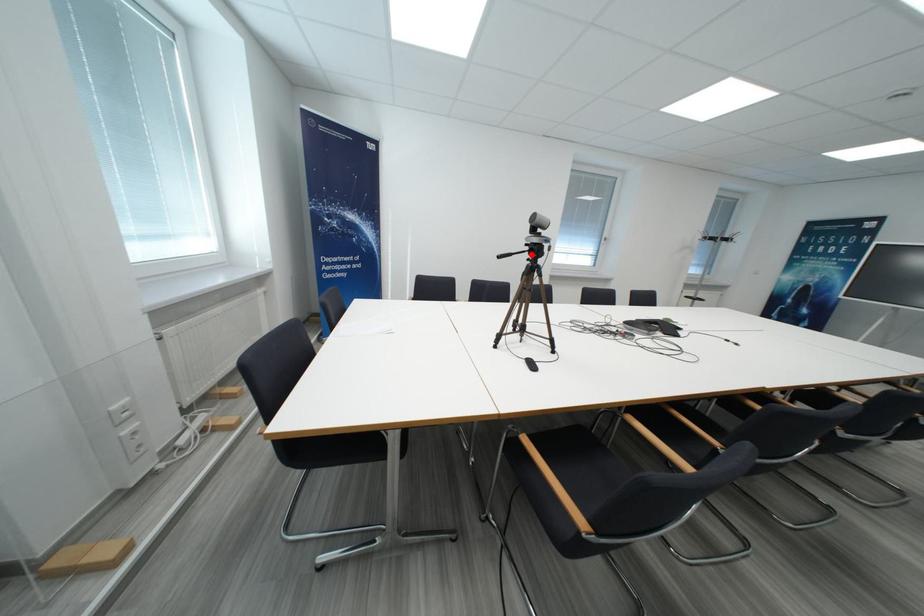
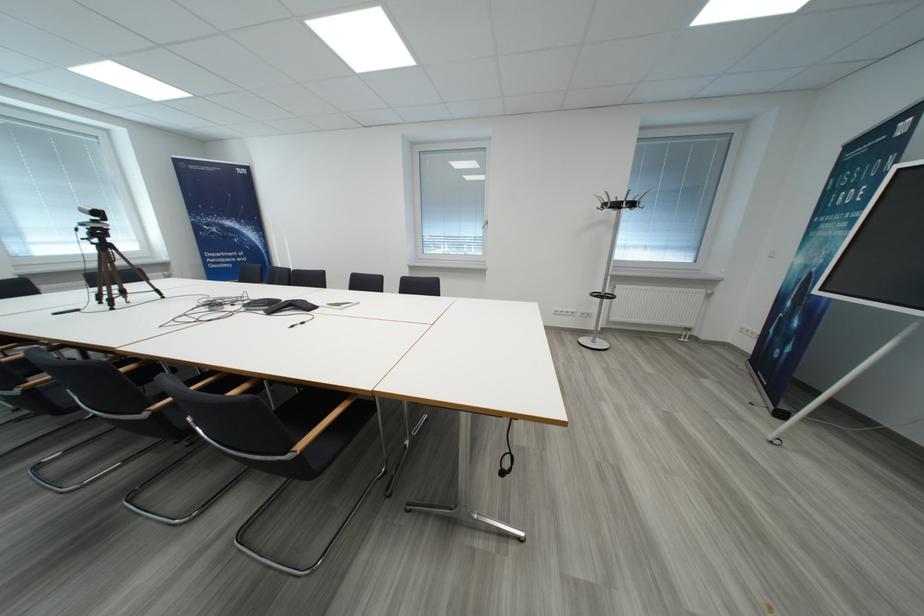
Locate, in the second image, the point that corresponds to the highlighted location in the first image.

(110, 237)